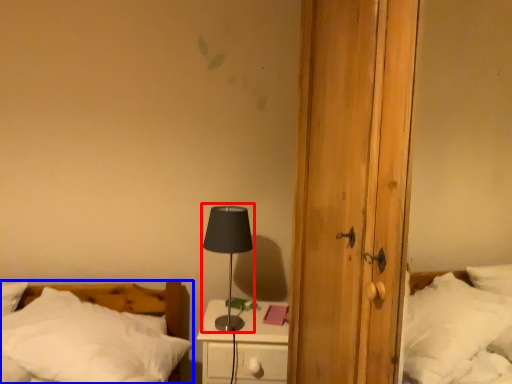
Question: Which object appears closest to the camera in this image, table lamp (highlighted by a red box) or bed (highlighted by a blue box)?

Choices:
 (A) table lamp
 (B) bed

Answer: (B)